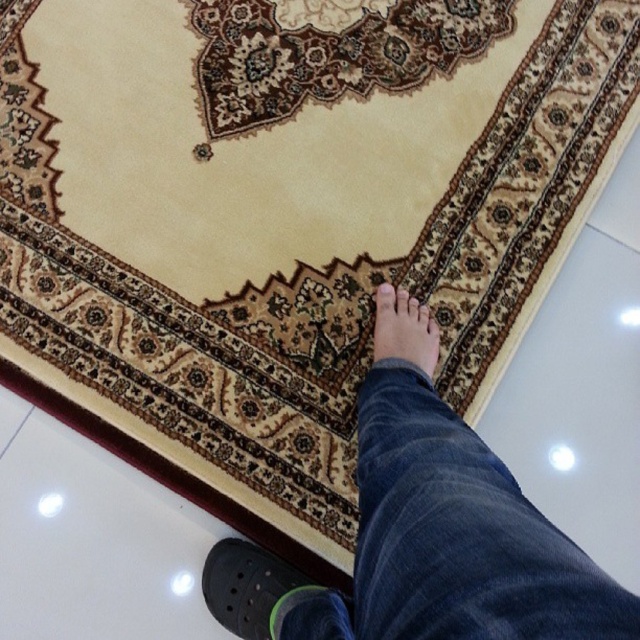
Describe the element at coordinates (403, 332) in the screenshot. I see `matte black foot at lower center` at that location.

Which is in front, point (408, 323) or point (288, 614)?

Point (288, 614)

Is point (426, 307) more distant than point (342, 596)?

Yes, it is.

Identify the location of matte black foot at lower center. The image size is (640, 640). (403, 332).

Can you confirm if denim jeans at center is smaller than blue fabric sock at lower center?

No.

Locate an element on the screen. The image size is (640, 640). denim jeans at center is located at coordinates (460, 534).

Is blue fabric sock at lower center to the left of matte brown toe at center from the viewer's perspective?

Yes, blue fabric sock at lower center is to the left of matte brown toe at center.

Measure the distance between blue fabric sock at lower center and matte brown toe at center.

blue fabric sock at lower center is 14.63 inches from matte brown toe at center.

Who is more distant from viewer, (340, 634) or (412, 307)?

The point (412, 307) is behind.

At what (x,y) coordinates should I click in order to perform the action: click on blue fabric sock at lower center. Please return your answer as a coordinate pair (x, y). Looking at the image, I should click on (310, 614).